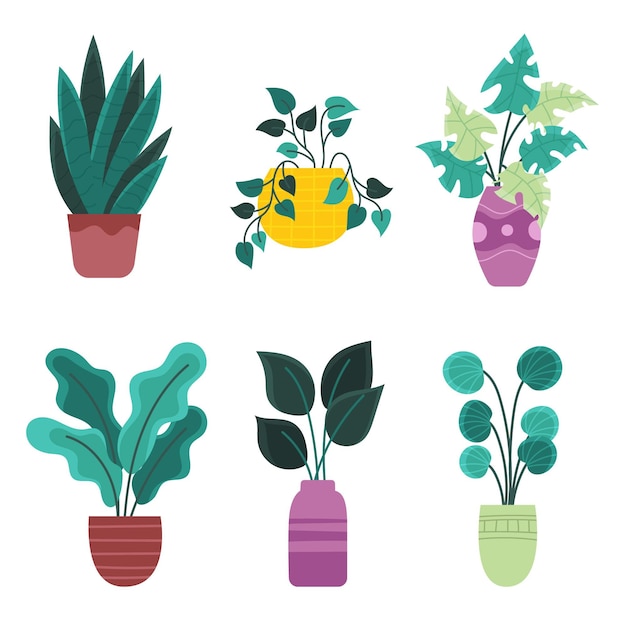
At what (x,y) coordinates should I click in order to perform the action: click on brown vases. Please return your answer as a coordinate pair (x, y). The width and height of the screenshot is (626, 626). Looking at the image, I should click on click(136, 566), click(317, 545), click(508, 255), click(103, 240).